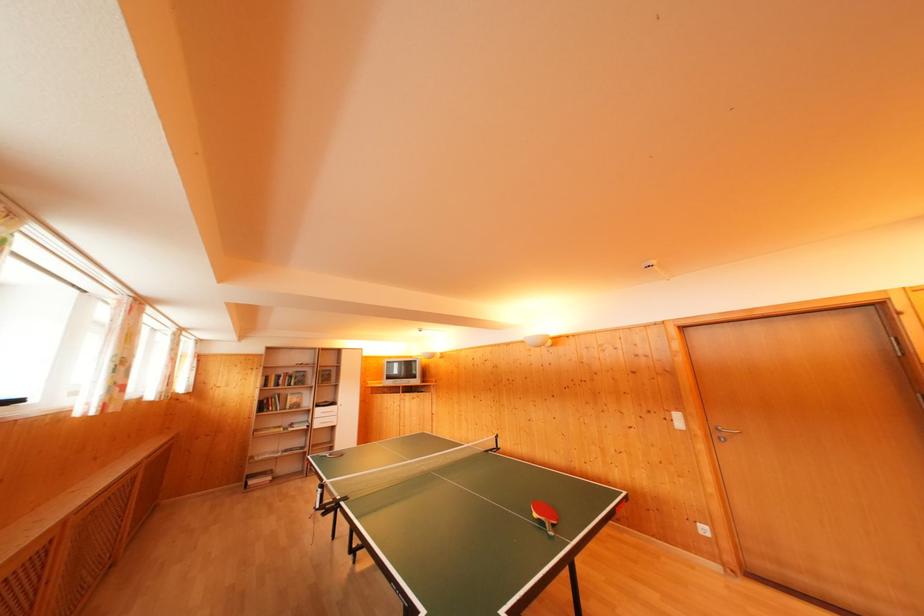
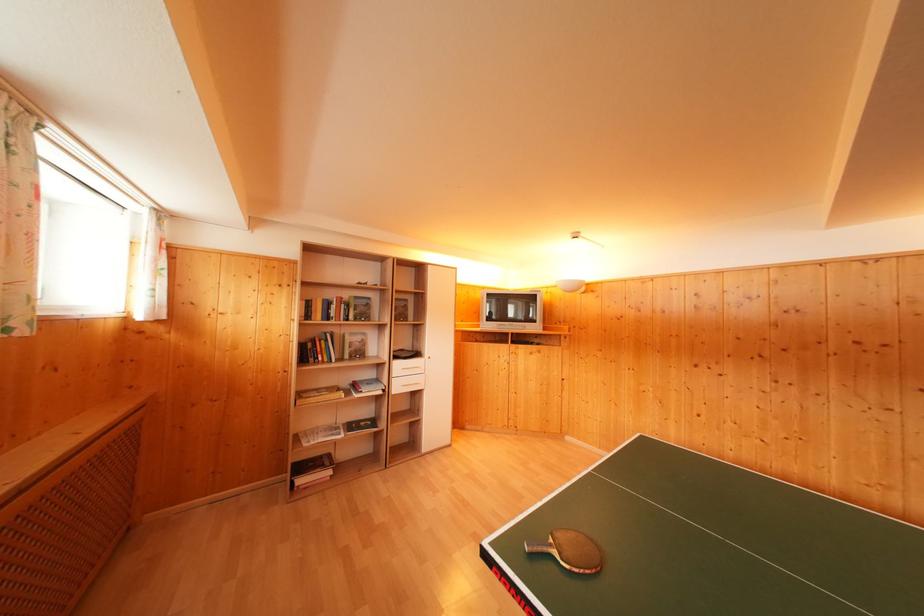
The point at (321, 421) is marked in the first image. Where is the corresponding point in the second image?

(398, 379)